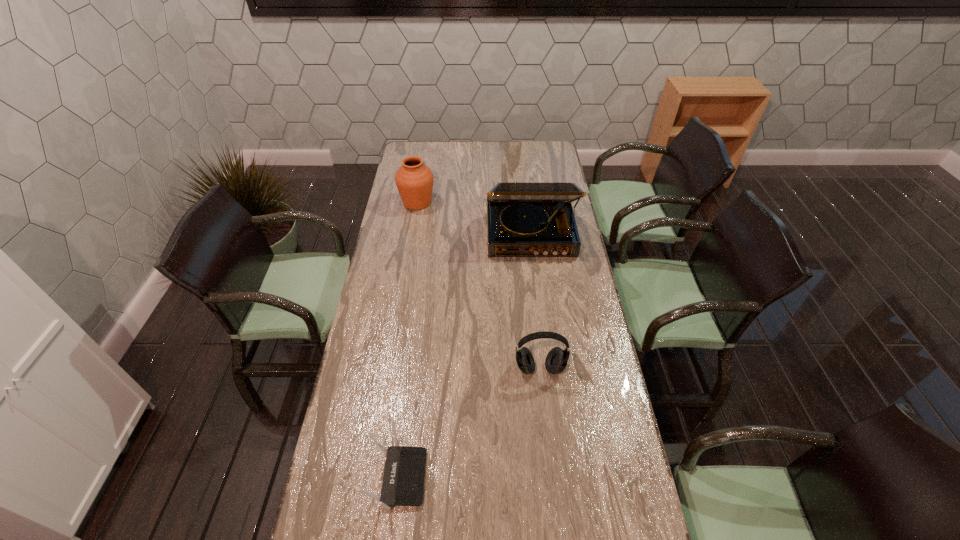
Find the location of a particular element. The width and height of the screenshot is (960, 540). vacant space situated 0.350m on the ear cups of the headset is located at coordinates (553, 493).

Identify the location of vacant space located 0.360m on the front-facing side of the nearest object. Image resolution: width=960 pixels, height=540 pixels. (554, 477).

Identify the location of urn present at the left edge. [x=414, y=180].

This screenshot has width=960, height=540. I want to click on router that is at the left edge, so click(403, 481).

Where is `record player located at the right edge`? This screenshot has width=960, height=540. record player located at the right edge is located at coordinates (524, 219).

Locate an element on the screen. The width and height of the screenshot is (960, 540). headset positioned at the right edge is located at coordinates (556, 361).

Identify the location of free region at the far edge of the desktop. This screenshot has width=960, height=540. (479, 144).

Locate an element on the screen. This screenshot has height=540, width=960. blank area at the left edge is located at coordinates (399, 325).

In the image, there is a desktop. Where is `vacant area at the right edge`? This screenshot has width=960, height=540. vacant area at the right edge is located at coordinates (619, 458).

I want to click on vacant region at the far left corner of the desktop, so click(427, 145).